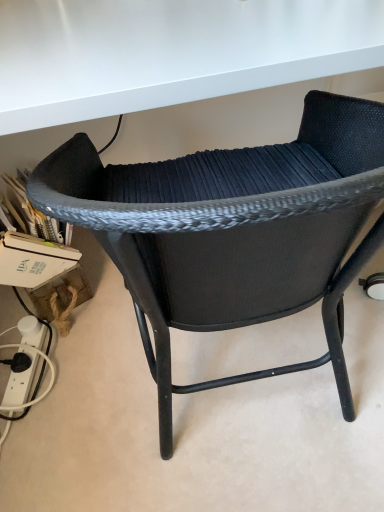
Image resolution: width=384 pixels, height=512 pixels. Find the location of `free spot in front of black plastic plug at lower left`. free spot in front of black plastic plug at lower left is located at coordinates point(36,429).